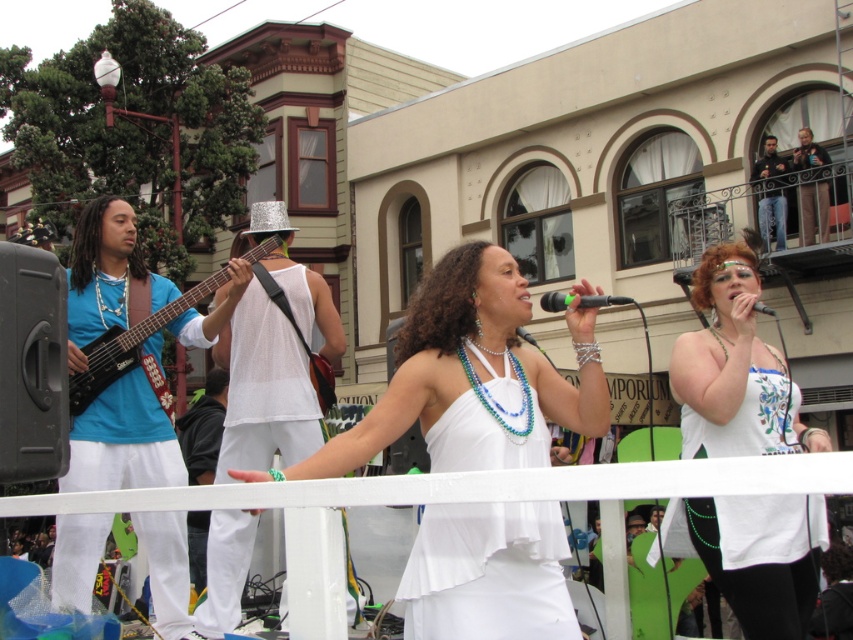
Question: Is white satin dress at center wider than matte black electric guitar at left?

Choices:
 (A) yes
 (B) no

Answer: (B)

Question: Does black matte microphone at center appear under black matte microphone at upper center?

Choices:
 (A) no
 (B) yes

Answer: (A)

Question: Considering the real-world distances, which object is closest to the white fabric dress at center?

Choices:
 (A) black matte microphone at center
 (B) matte black electric guitar at left

Answer: (A)

Question: Among these points, which one is nearest to the camera?

Choices:
 (A) (538, 301)
 (B) (167, 307)
 (C) (589, 346)
 (D) (729, 296)

Answer: (C)

Question: Is white satin dress at center below black matte microphone at upper center?

Choices:
 (A) yes
 (B) no

Answer: (A)

Question: Which of the following is the farthest from the observer?

Choices:
 (A) (125, 353)
 (B) (585, 307)

Answer: (A)